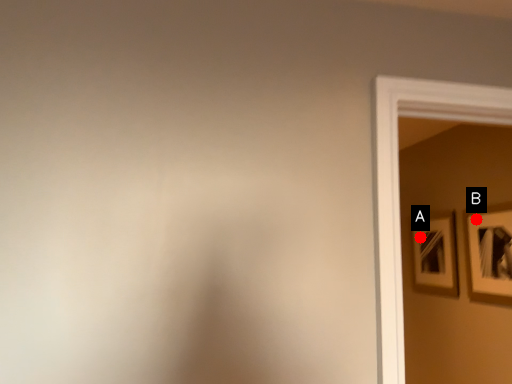
Question: Two points are circled on the image, labeled by A and B beside each circle. Which point is farther from the camera taking this photo?

Choices:
 (A) A is further
 (B) B is further

Answer: (A)